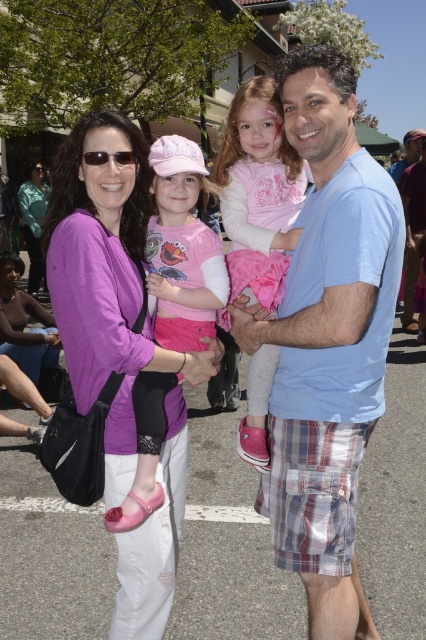
Question: Does purple soft fabric shirt at upper left have a smaller size compared to pink fabric dress at center?

Choices:
 (A) yes
 (B) no

Answer: (B)

Question: Which of these objects is positioned farthest from the pink fleece jacket at center?

Choices:
 (A) matte teal jacket at upper left
 (B) pink fabric dress at center
 (C) light blue cotton shirt at center
 (D) purple soft fabric shirt at upper left

Answer: (A)

Question: Which object is closer to the camera taking this photo?

Choices:
 (A) light blue cotton shirt at center
 (B) matte teal jacket at upper left
 (C) pink fabric dress at center
 (D) pink fleece jacket at center

Answer: (A)

Question: Is purple soft fabric shirt at upper left thinner than pink fleece jacket at center?

Choices:
 (A) yes
 (B) no

Answer: (B)

Question: Which of the following is the closest to the observer?

Choices:
 (A) (37, 211)
 (B) (374, 384)
 (C) (183, 141)
 (D) (89, 188)

Answer: (D)

Question: Can you confirm if light blue cotton shirt at center is bigger than pink fabric dress at center?

Choices:
 (A) no
 (B) yes

Answer: (B)